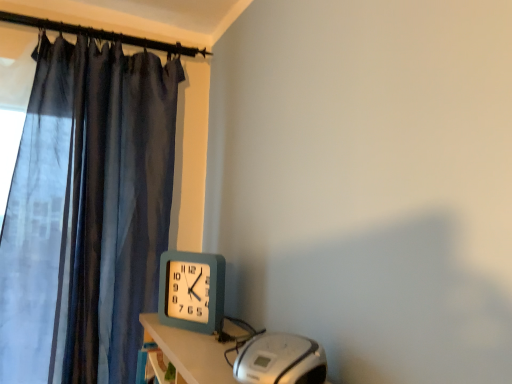
Question: From a real-world perspective, relative to teal plastic wall clock at upper center, is silver metallic cd player at lower right vertically above or below?

Choices:
 (A) above
 (B) below

Answer: (B)

Question: In terms of height, does silver metallic cd player at lower right look taller or shorter compared to teal plastic wall clock at upper center?

Choices:
 (A) short
 (B) tall

Answer: (A)

Question: Visually, is silver metallic cd player at lower right positioned to the left or to the right of teal plastic wall clock at upper center?

Choices:
 (A) left
 (B) right

Answer: (B)

Question: Looking at the image, does teal plastic wall clock at upper center seem bigger or smaller compared to silver metallic cd player at lower right?

Choices:
 (A) small
 (B) big

Answer: (A)

Question: Is teal plastic wall clock at upper center inside or outside of silver metallic cd player at lower right?

Choices:
 (A) outside
 (B) inside

Answer: (A)

Question: Is point (178, 264) closer or farther from the camera than point (287, 352)?

Choices:
 (A) farther
 (B) closer

Answer: (A)

Question: Considering the relative positions of teal plastic wall clock at upper center and silver metallic cd player at lower right in the image provided, is teal plastic wall clock at upper center to the left or to the right of silver metallic cd player at lower right?

Choices:
 (A) right
 (B) left

Answer: (B)